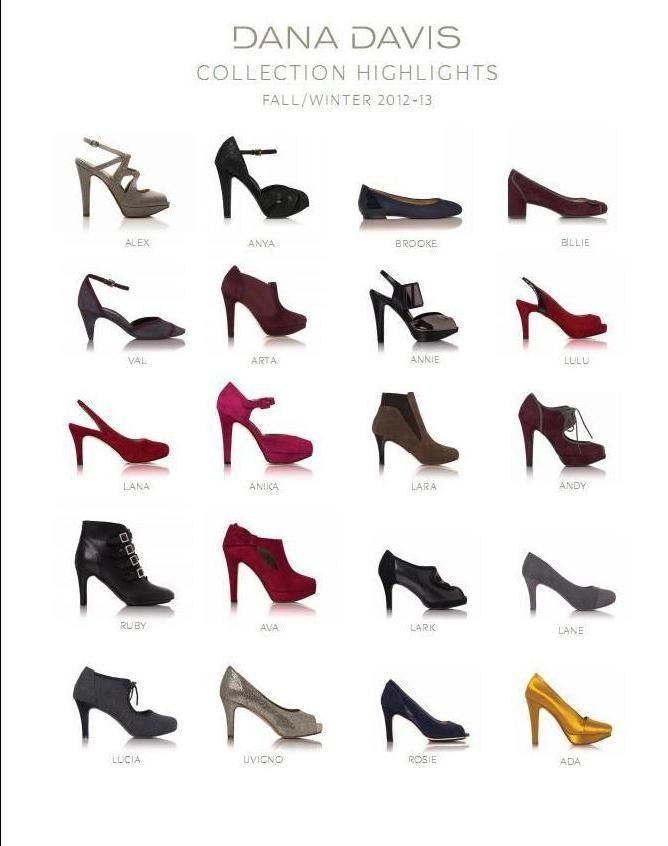
I want to click on shoes in a vertical column on the right side, so click(x=574, y=206), click(x=578, y=327), click(x=587, y=449), click(x=587, y=591), click(x=587, y=729).